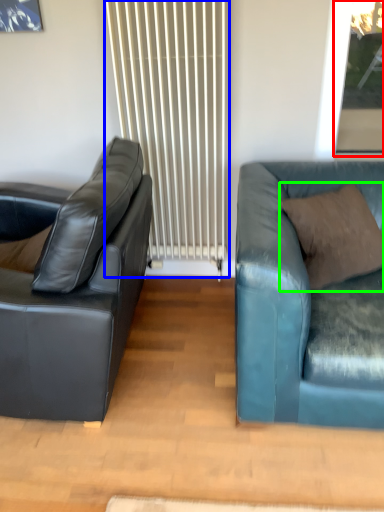
Question: Based on their relative distances, which object is farther from window screen (highlighted by a red box)? Choose from radiator (highlighted by a blue box) and pillow (highlighted by a green box).

Choices:
 (A) radiator
 (B) pillow

Answer: (A)